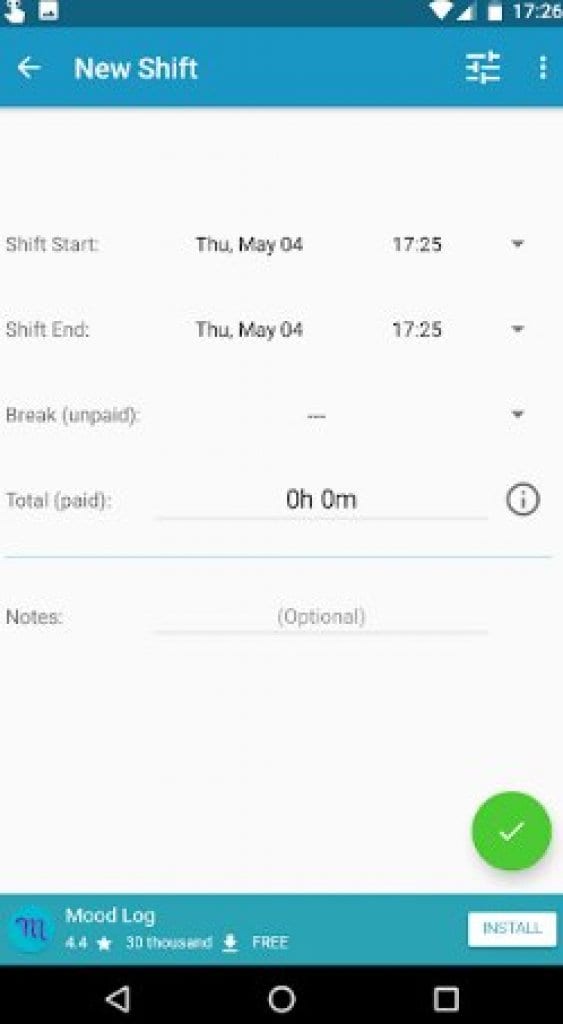
At what (x,y) coordinates should I click in order to perform the action: click on notes label. Please return your answer as a coordinate pair (x, y). The height and width of the screenshot is (1024, 563). Looking at the image, I should click on (28, 615).